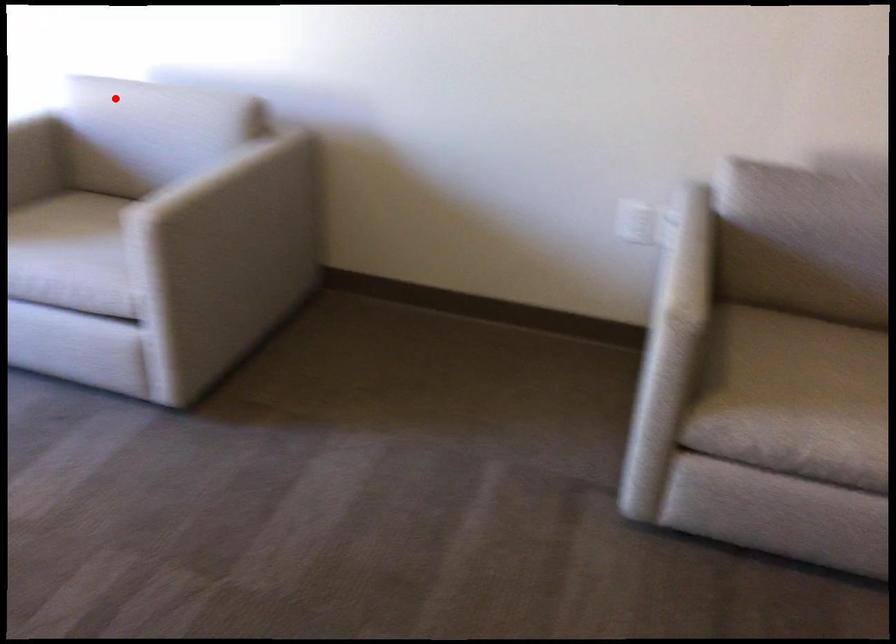
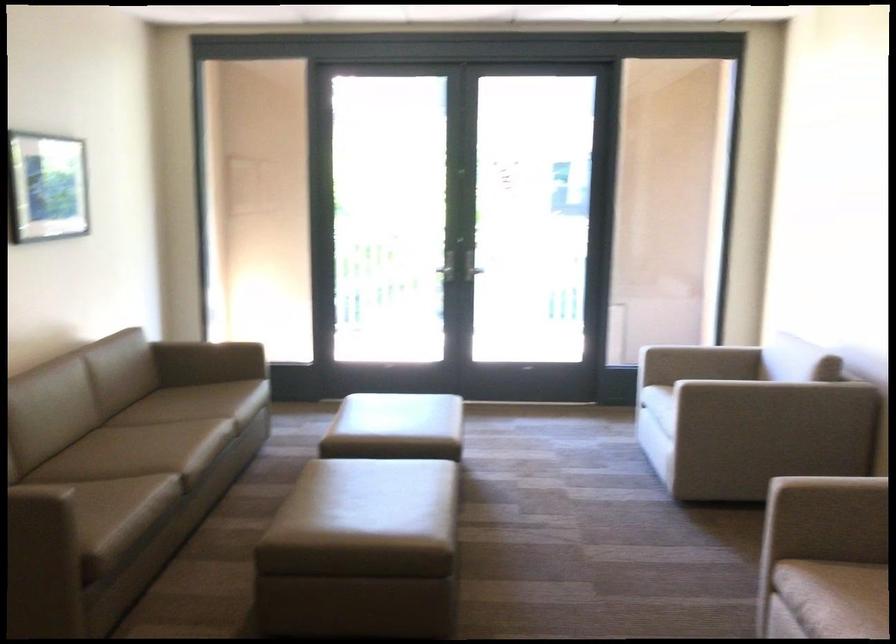
Question: I am providing you with two images of the same scene from different viewpoints. A red point is shown in image1. For the corresponding object point in image2, is it positioned nearer or farther from the camera?

Choices:
 (A) Nearer
 (B) Farther

Answer: (B)